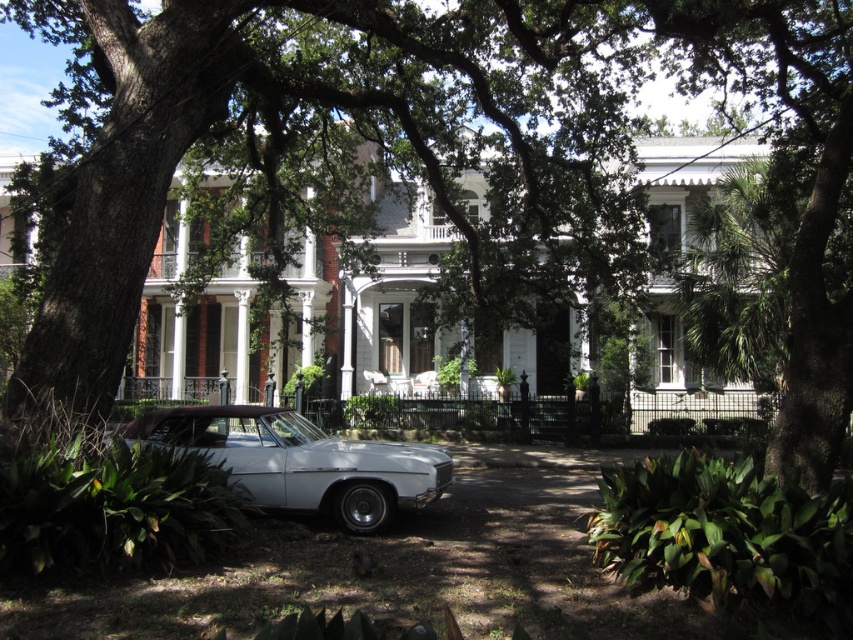
You are a delivery person trying to park your truck which is 2 meters tall. You see the white glossy car at lower center and the white painted wood porch at center. Can your truck pass under the porch without hitting it?

The white glossy car at lower center is shorter than the white painted wood porch at center. Since the car is shorter than the porch, the truck which is 2 meters tall can pass under the porch as long as the porch height is more than 2 meters. However, the exact height of the porch isn

You are standing at the point where the vintage car is parked on the dirt driveway. Looking towards the row of houses, which direction should you turn to face the green leafy tree at center represented by point (339, 150)?

The green leafy tree at center is located at point (339, 150), which is directly ahead of the vintage car parked on the dirt driveway. Therefore, you should turn to face the center direction to look at the green leafy tree at center.

You are a pedestrian standing on the sidewalk in front of the row of houses. You want to walk to the white glossy car at lower center. Is the green leafy tree at center blocking your path?

The green leafy tree at center is in front of the white glossy car at lower center, so it is blocking the path to the car.